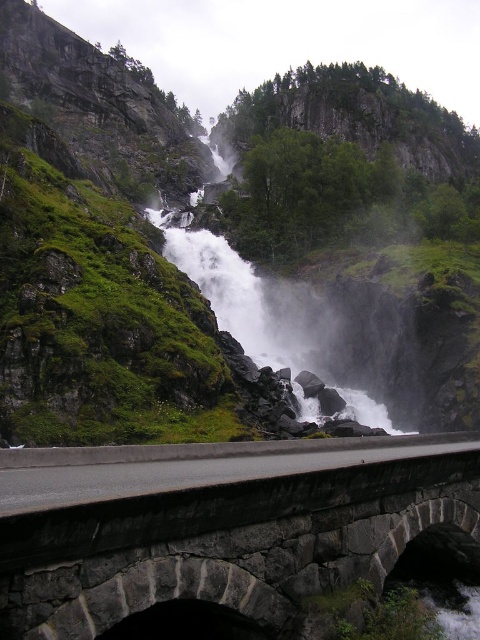
Question: Is dark gray stone bridge at center to the left of white mist at center from the viewer's perspective?

Choices:
 (A) no
 (B) yes

Answer: (A)

Question: Which of the following is the closest to the observer?

Choices:
 (A) white mist at center
 (B) dark gray stone bridge at center

Answer: (B)

Question: Is dark gray stone bridge at center wider than white mist at center?

Choices:
 (A) yes
 (B) no

Answer: (B)

Question: Does gray asphalt highway at lower center appear over white mist at center?

Choices:
 (A) yes
 (B) no

Answer: (B)

Question: Among these objects, which one is farthest from the camera?

Choices:
 (A) dark gray stone bridge at center
 (B) white mist at center

Answer: (B)

Question: Which of these objects is positioned closest to the dark gray stone bridge at center?

Choices:
 (A) white mist at center
 (B) gray asphalt highway at lower center

Answer: (B)